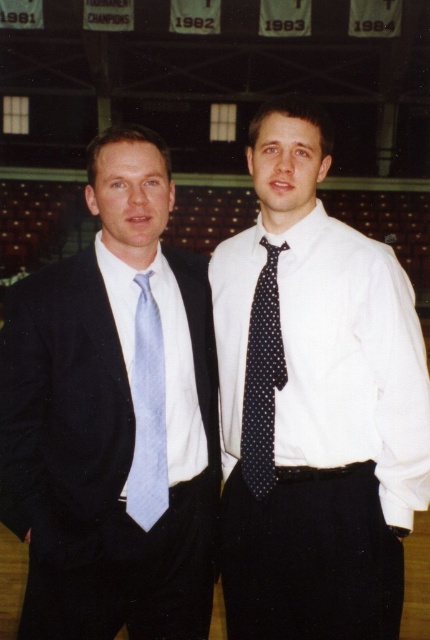
You are a photographer setting up for an event. You need to ensure that the white dotted tie at center and the light blue silk tie at left are visible in the frame. Given that the camera has a limited focus range, which tie should you focus on first to ensure proper focus, considering their sizes?

The white dotted tie at center is larger in width than the light blue silk tie at left, so focusing on the white dotted tie at center first would ensure proper focus due to its larger size.

You are a photographer setting up for an event. You need to ensure there is enough space between the two subjects so that your camera can capture both ties clearly. The minimum distance required between the white dotted tie at center and the matte blue tie at left for your camera is 28 inches. Is the current distance sufficient?

The white dotted tie at center is 30.09 inches from the matte blue tie at left, which exceeds the minimum required distance of 28 inches. Therefore, the current distance is sufficient for the camera to capture both ties clearly.